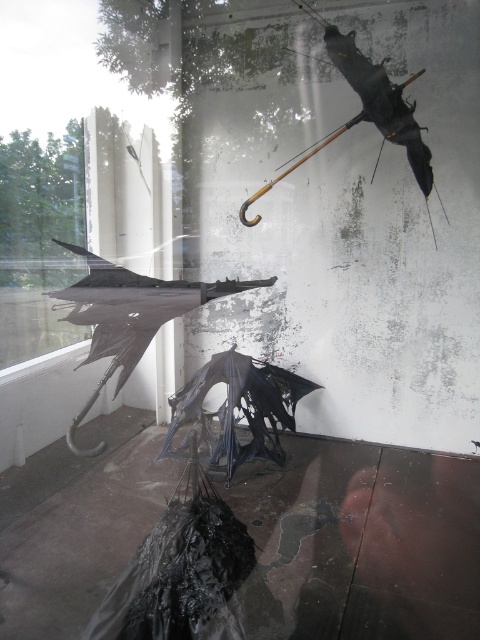
Is point (68, 1) less distant than point (175, 422)?

No, (68, 1) is behind (175, 422).

Who is shorter, transparent glass umbrella at left or transparent plastic umbrella at center?

With less height is transparent plastic umbrella at center.

Is point (45, 54) positioned in front of point (260, 362)?

Yes, point (45, 54) is closer to viewer.

Identify the location of transparent glass umbrella at left. The height and width of the screenshot is (640, 480). (70, 168).

Between point (157, 128) and point (131, 360), which one is positioned in front?

Point (131, 360) is in front.

Can you confirm if transparent glass umbrella at left is wider than matte black umbrella at center?

Indeed, transparent glass umbrella at left has a greater width compared to matte black umbrella at center.

Identify the location of transparent glass umbrella at left. (70, 168).

Image resolution: width=480 pixels, height=640 pixels. What do you see at coordinates (130, 316) in the screenshot? I see `matte black umbrella at center` at bounding box center [130, 316].

Which is more to the left, matte black umbrella at center or transparent plastic umbrella at center?

From the viewer's perspective, matte black umbrella at center appears more on the left side.

Between point (147, 328) and point (280, 458), which one is positioned in front?

Point (147, 328) is more forward.

Locate an element on the screen. The image size is (480, 640). matte black umbrella at center is located at coordinates pyautogui.click(x=130, y=316).